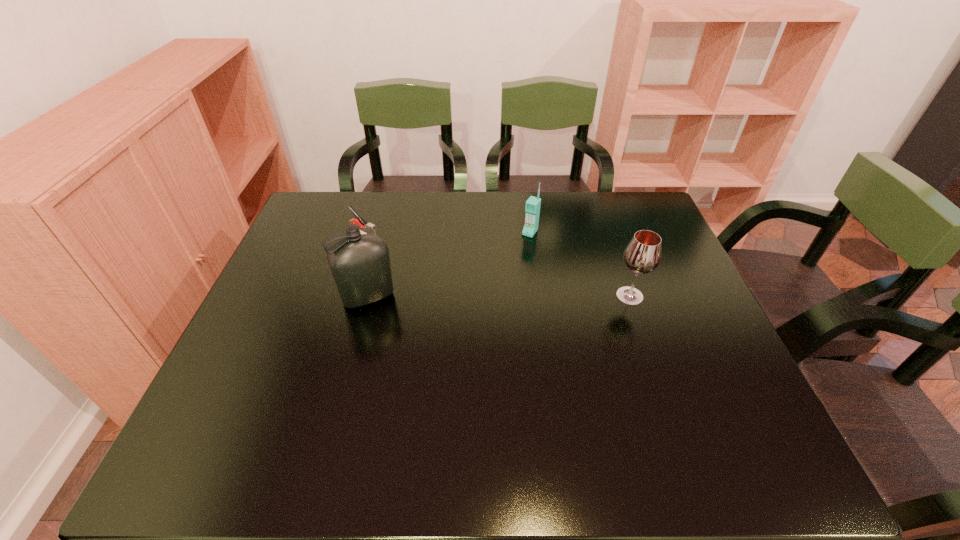
The width and height of the screenshot is (960, 540). What are the coordinates of `free space that satisfies the following two spatial constraints: 1. on the front side of the shortest object; 2. on the right side of the wineglass` in the screenshot? It's located at (345, 296).